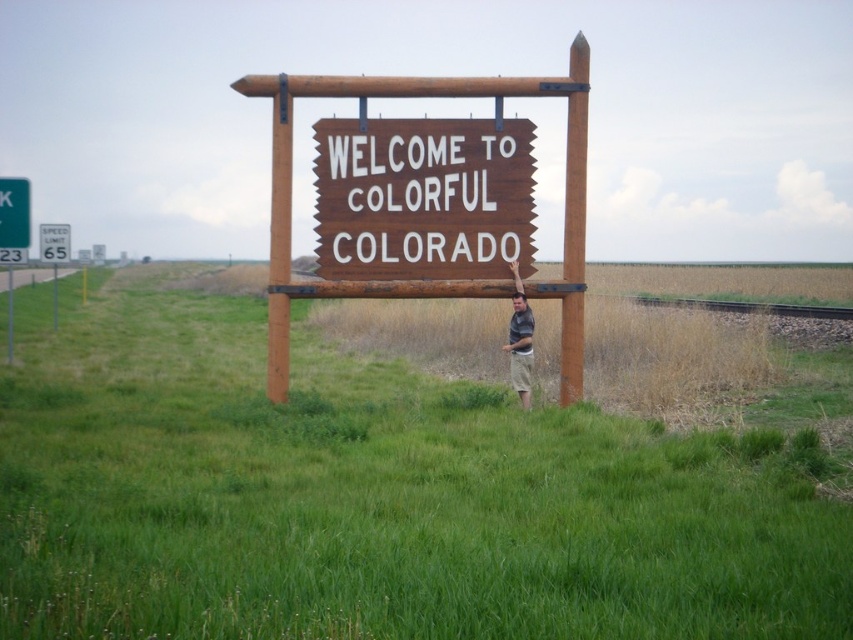
Is green grassy field at center closer to the viewer compared to brown wooden sign at center?

That is True.

Is point (111, 576) closer to viewer compared to point (467, 205)?

That is True.

Which is behind, point (788, 528) or point (345, 144)?

Point (345, 144)

Where is `green grassy field at center`? This screenshot has height=640, width=853. green grassy field at center is located at coordinates (375, 499).

Who is positioned more to the left, brown wooden sign at center or matte gray shirt at center?

Positioned to the left is brown wooden sign at center.

Based on the photo, is brown wooden sign at center behind matte gray shirt at center?

Yes, brown wooden sign at center is behind matte gray shirt at center.

Who is more distant from viewer, (317, 244) or (527, 388)?

The point (527, 388) is behind.

Where is `brown wooden sign at center`? The image size is (853, 640). brown wooden sign at center is located at coordinates (422, 198).

Can you confirm if matte gray shirt at center is shorter than brushed metal speed limit sign at left?

No.

Does point (512, 362) lie behind point (44, 230)?

No, (512, 362) is closer to viewer.

Which is behind, point (517, 369) or point (50, 234)?

The point (50, 234) is more distant.

At what (x,y) coordinates should I click in order to perform the action: click on matte gray shirt at center. Please return your answer as a coordinate pair (x, y). Looking at the image, I should click on (520, 340).